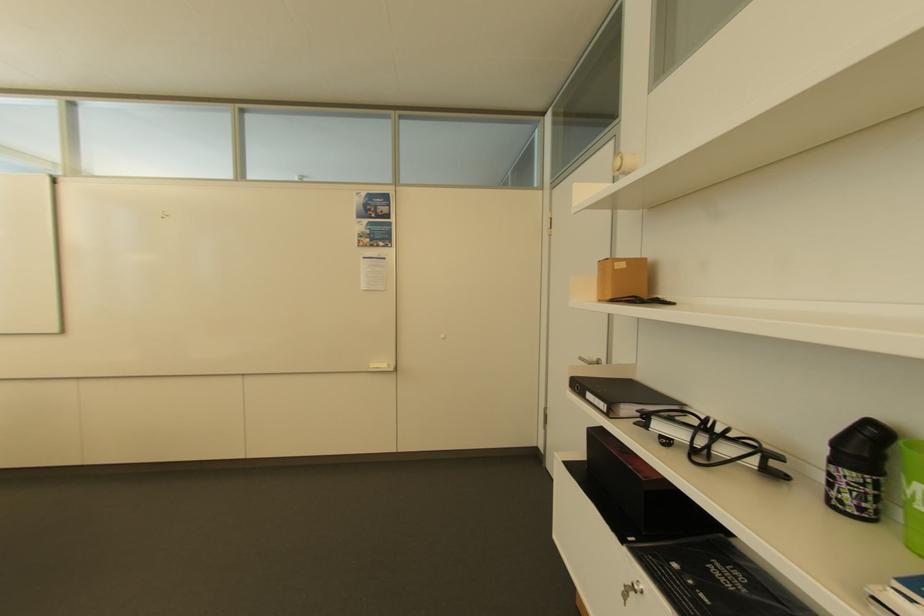
Describe the element at coordinates (630, 590) in the screenshot. I see `the silver door handle` at that location.